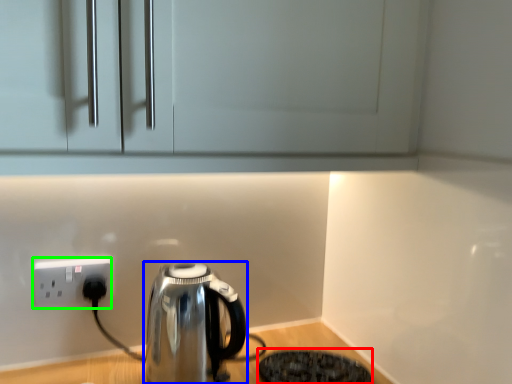
Question: Based on their relative distances, which object is farther from appliance (highlighted by a red box)? Choose from kettle (highlighted by a blue box) and power plugs and sockets (highlighted by a green box).

Choices:
 (A) kettle
 (B) power plugs and sockets

Answer: (B)